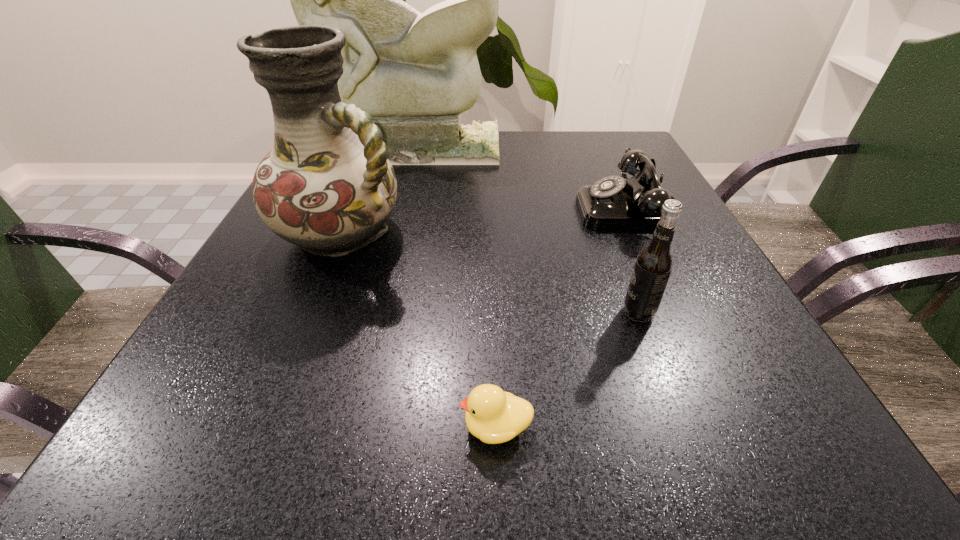
This screenshot has height=540, width=960. Find the location of `free space between the second nearest object and the vase`. free space between the second nearest object and the vase is located at coordinates (491, 272).

Locate an element on the screen. This screenshot has height=540, width=960. the second closest object relative to the sculpture is located at coordinates (614, 202).

Select which object appears as the fourth closest to the farthest object. Please provide its 2D coordinates. Your answer should be formatted as a tuple, i.e. [(x, y)], where the tuple contains the x and y coordinates of a point satisfying the conditions above.

[(493, 416)]